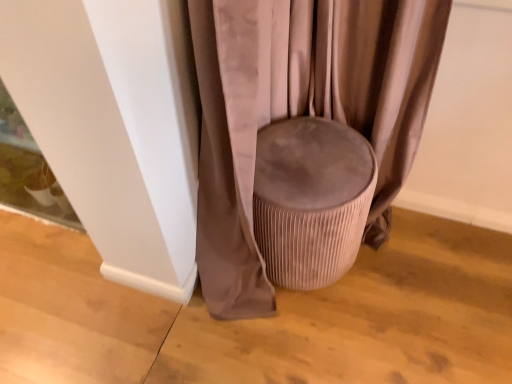
Question: Should I look upward or downward to see suede-like beige stool at center?

Choices:
 (A) up
 (B) down

Answer: (B)